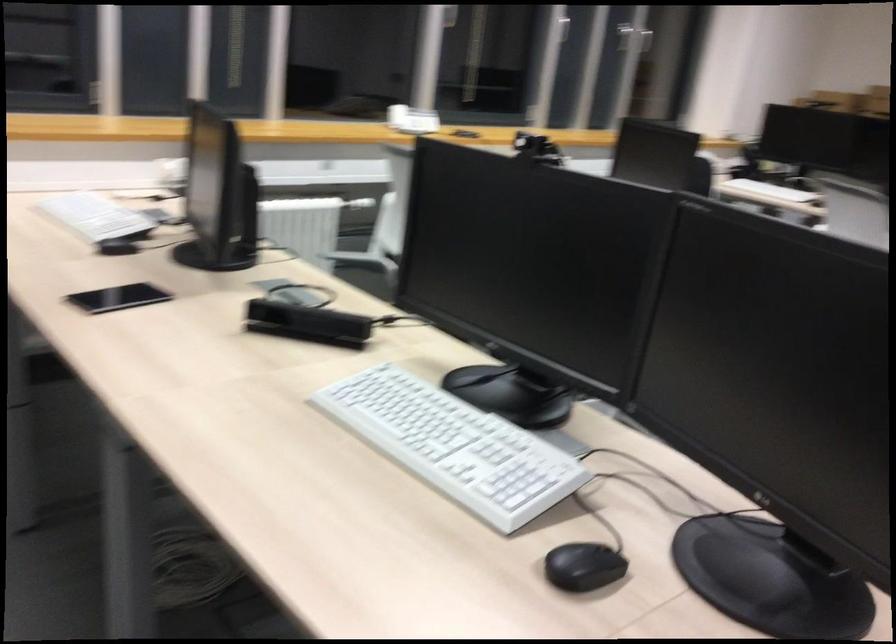
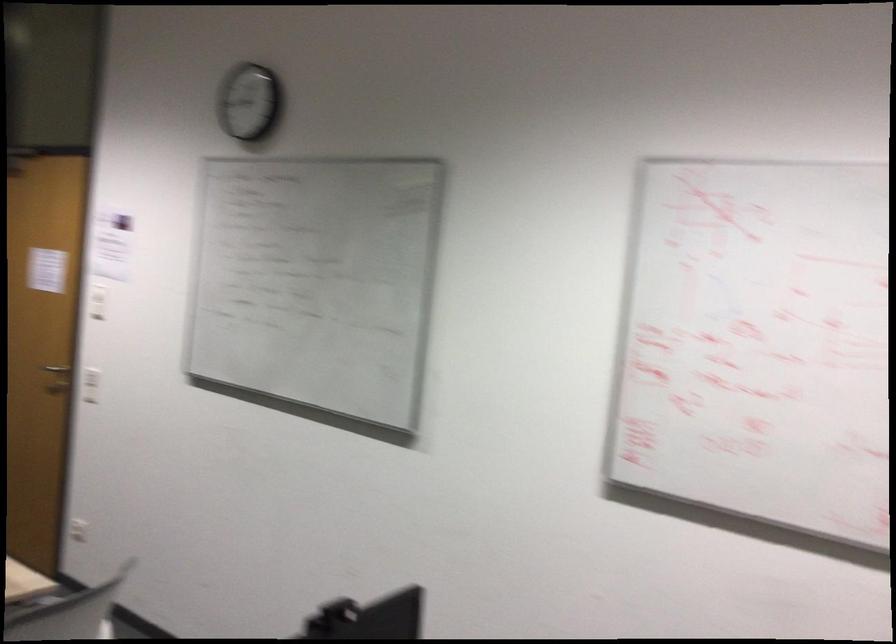
Question: The camera is either moving clockwise (left) or counter-clockwise (right) around the object. The first image is from the beginning of the video and the second image is from the end. Is the camera moving left or right when shooting the video?

Choices:
 (A) Left
 (B) Right

Answer: (A)